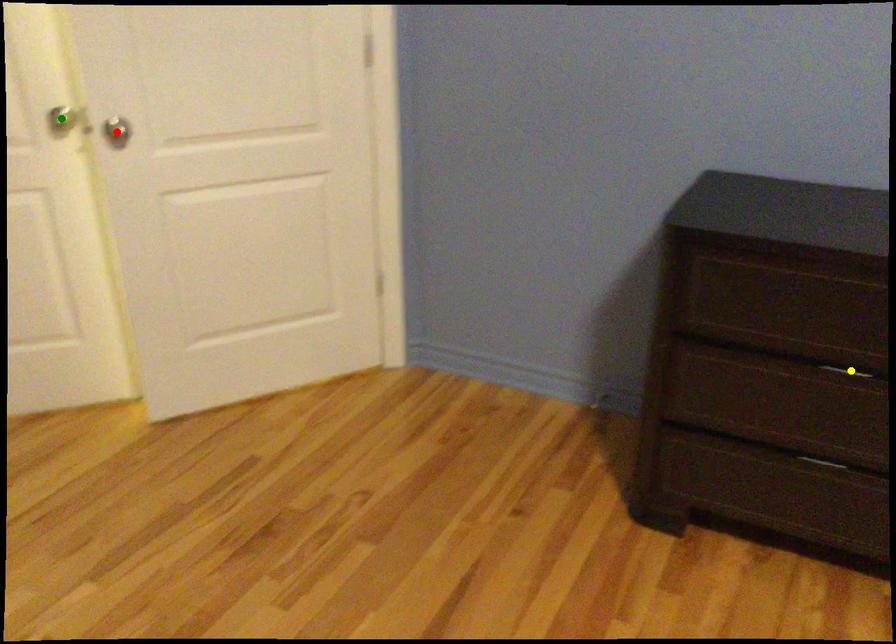
Order these from nearest to farthest:
yellow point, red point, green point

green point → red point → yellow point